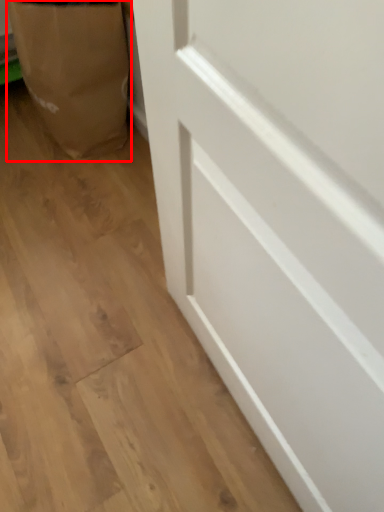
Question: Where is paper bag (annotated by the red box) located in relation to door in the image?

Choices:
 (A) left
 (B) right

Answer: (A)